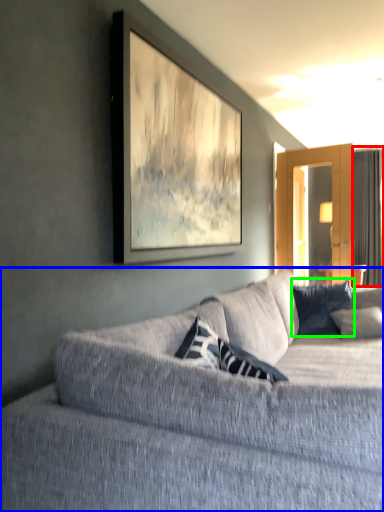
Question: Which is farther away from curtain (highlighted by a red box)? studio couch (highlighted by a blue box) or pillow (highlighted by a green box)?

Choices:
 (A) studio couch
 (B) pillow

Answer: (A)